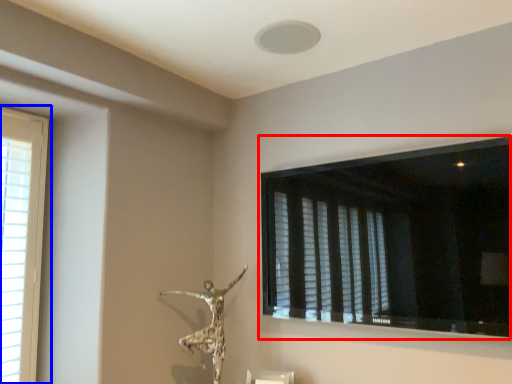
Question: Among these objects, which one is nearest to the camera, window (highlighted by a red box) or window (highlighted by a blue box)?

Choices:
 (A) window
 (B) window

Answer: (A)